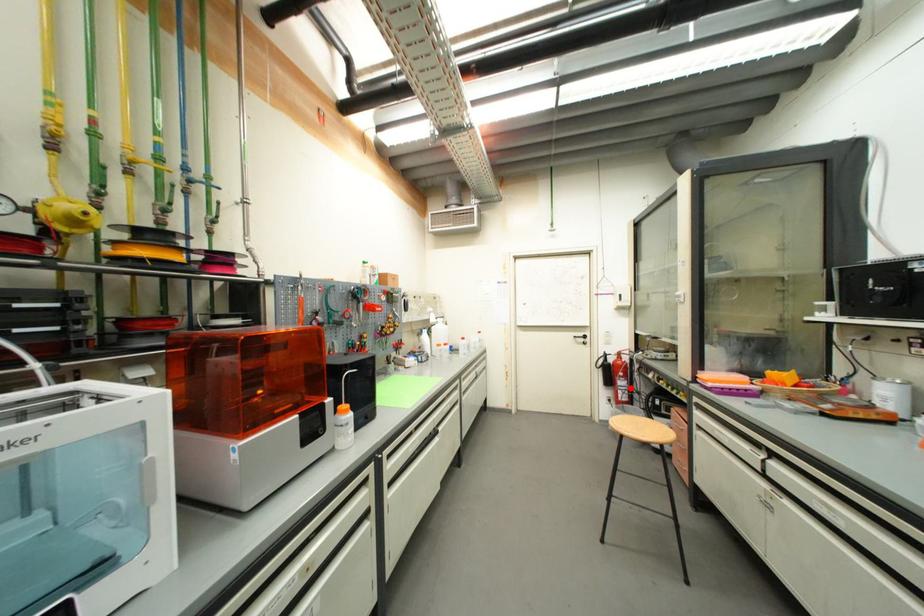
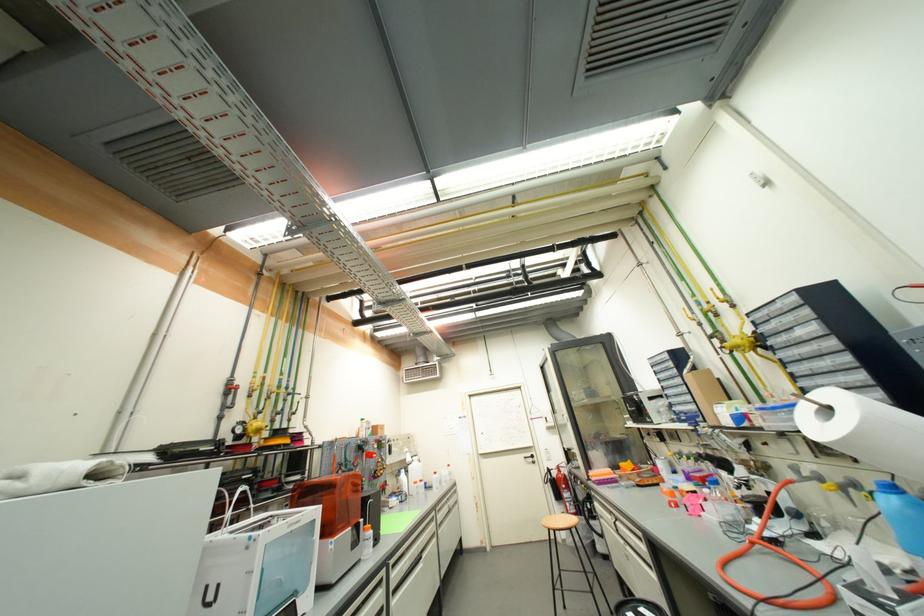
Question: I am providing you with two images of the same scene from different viewpoints. In image1, a red point is highlighted. Considering the same 3D point in image2, which of the following is correct?

Choices:
 (A) It is closer
 (B) It is farther

Answer: (B)